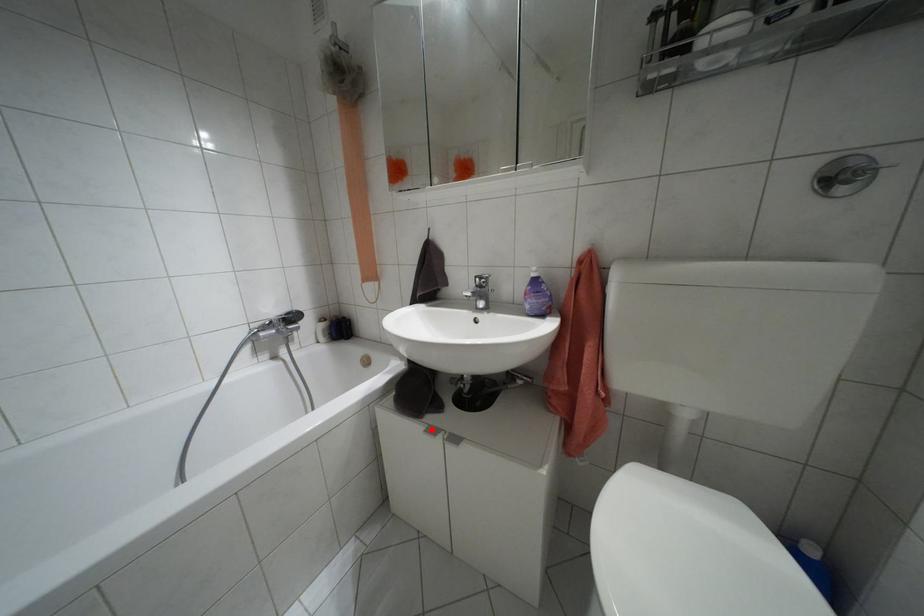
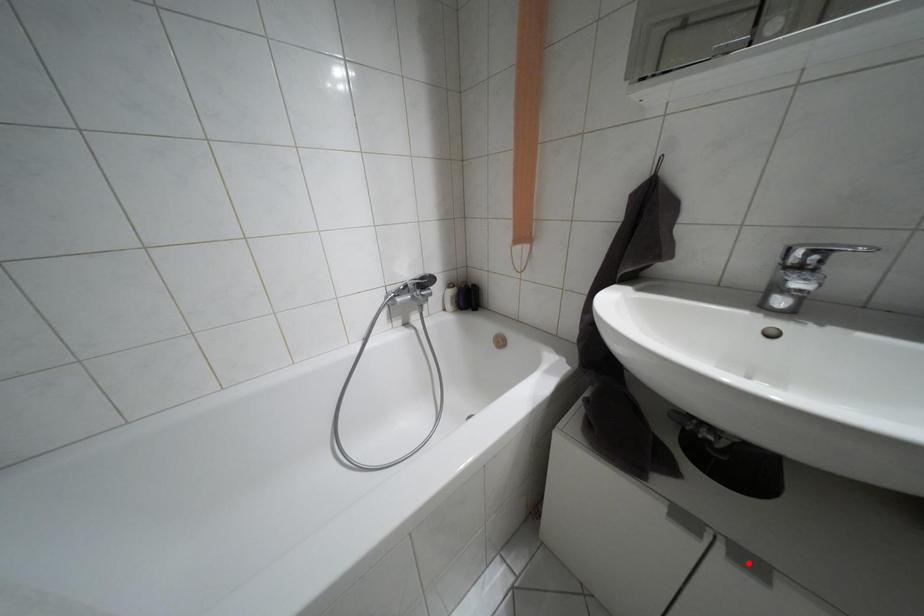
I am providing you with two images of the same scene from different viewpoints. A red point is marked on the first image and another point is marked on the second image. Is the red point in image1 aligned with the point shown in image2?

No